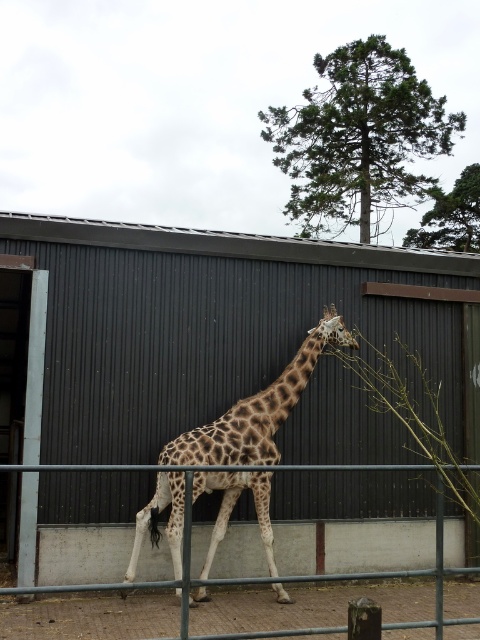
You are a zookeeper planning to place a feeding trough for the spotted fur giraffe at center. The enclosure has a dark gray corrugated metal wall on the right. To ensure the giraffe can easily access the trough, where should you position it relative to the giraffe?

The spotted fur giraffe at center is located at point (257, 410), so the feeding trough should be placed to the left of the giraffe to allow easy access since the giraffe is facing rightward and positioned off the left side of the frame.